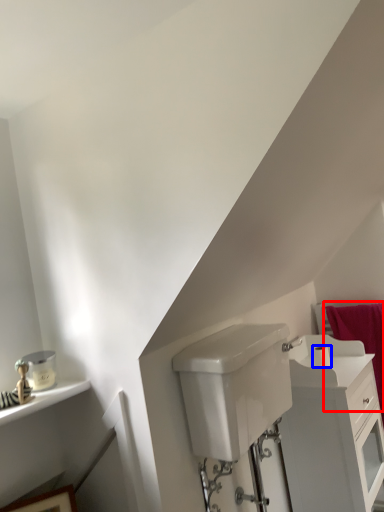
Question: Among these objects, which one is farthest to the camera, bath towel (highlighted by a red box) or toilet paper (highlighted by a blue box)?

Choices:
 (A) bath towel
 (B) toilet paper

Answer: (A)